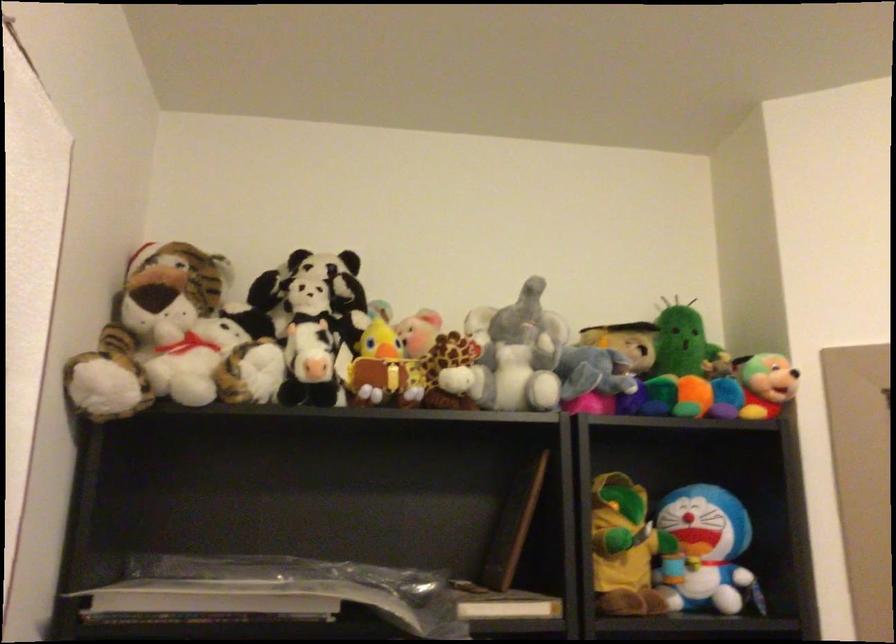
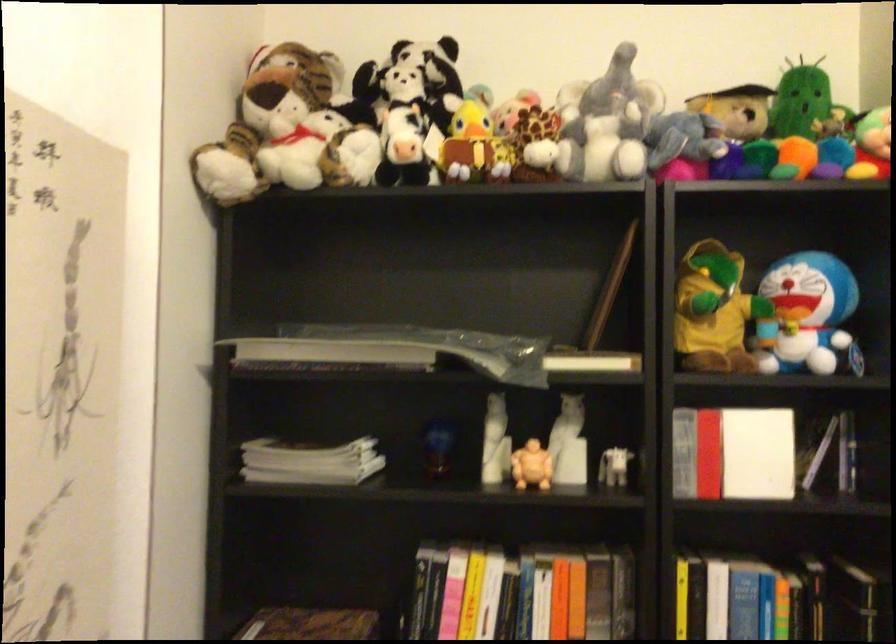
Locate, in the second image, the point that corresponds to point (315, 292) in the first image.

(410, 79)